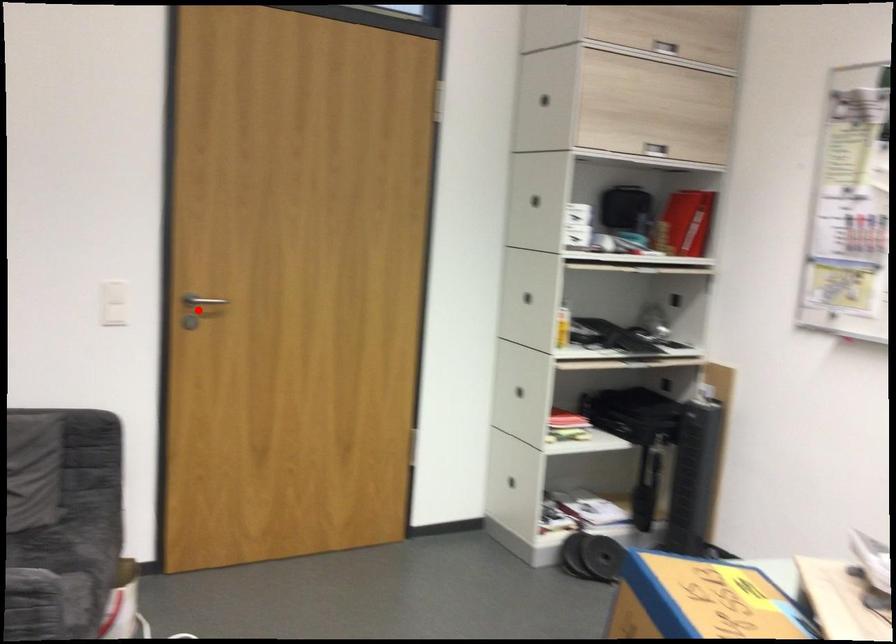
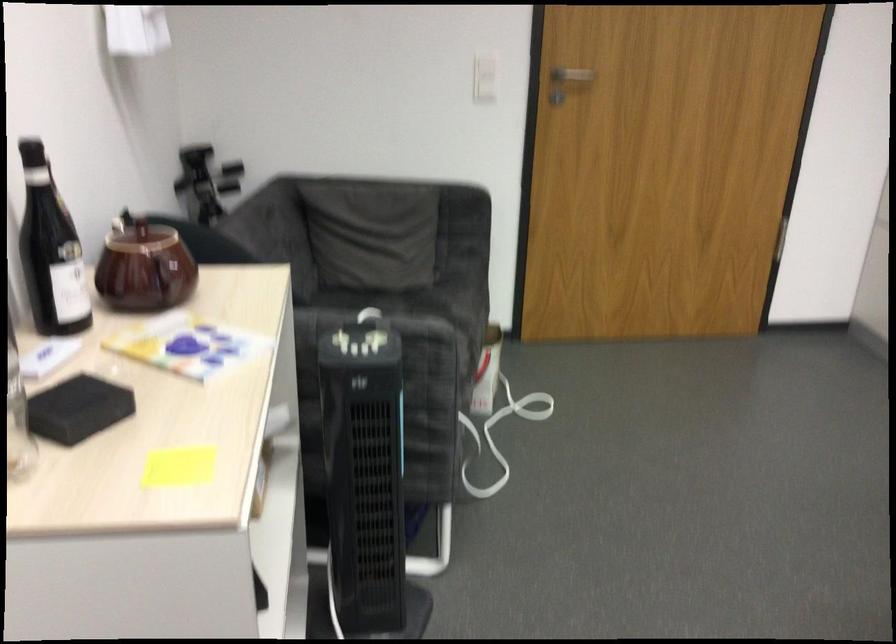
Question: I am providing you with two images of the same scene from different viewpoints. A red point is marked on the first image. Can you still see the location of the red point in image 2?

Choices:
 (A) Yes
 (B) No

Answer: (A)